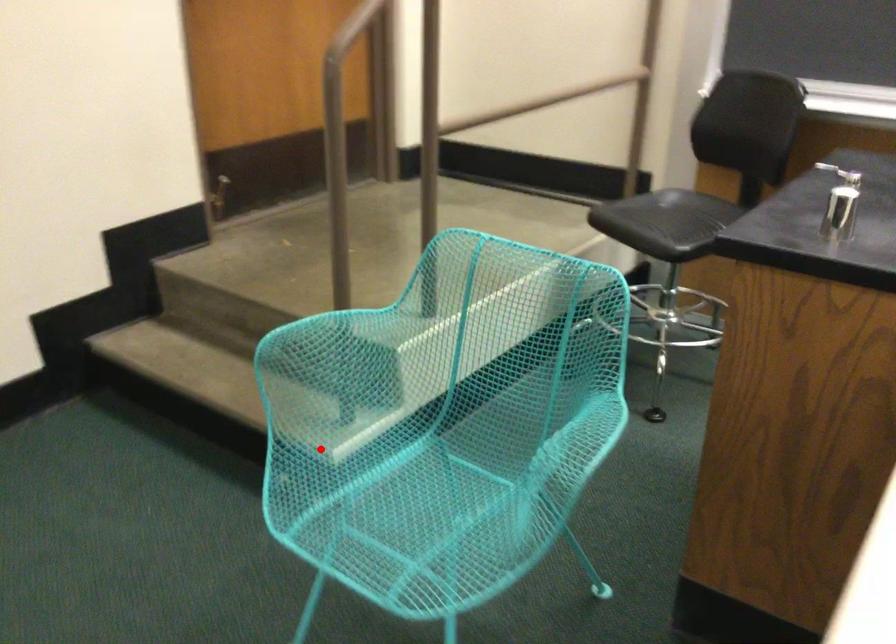
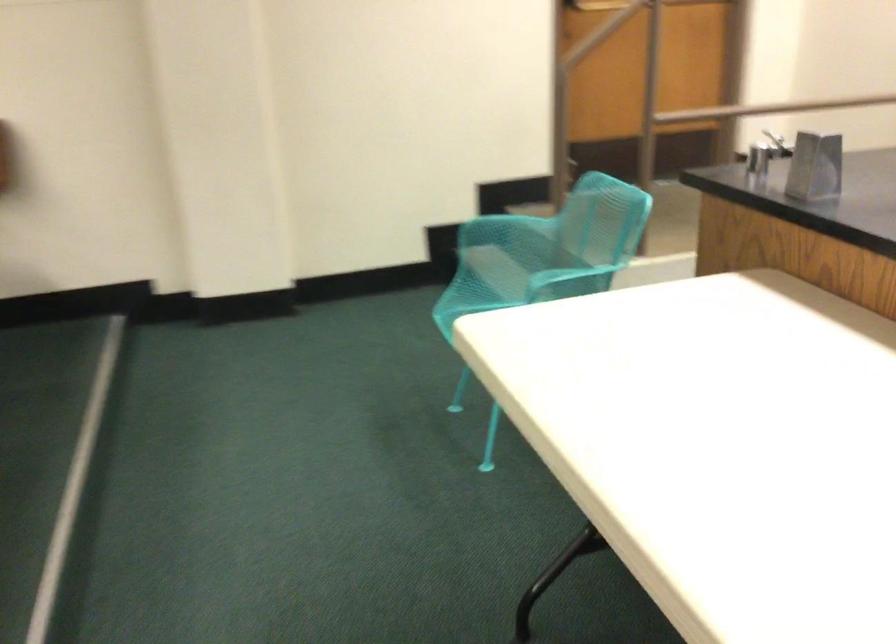
Question: I am providing you with two images of the same scene from different viewpoints. Given a red point in image1, look at the same physical point in image2. Is it:

Choices:
 (A) Closer to the viewpoint
 (B) Farther from the viewpoint

Answer: (B)